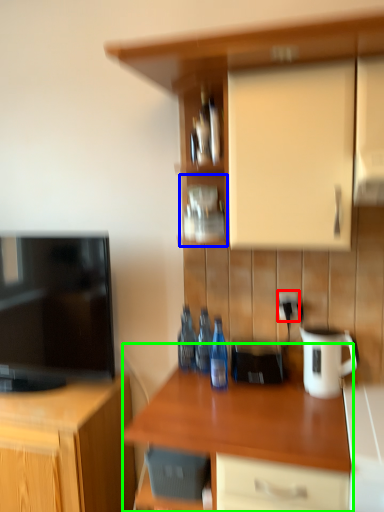
Question: Which is farther away from electric outlet (highlighted by a red box)? shelf (highlighted by a blue box) or countertop (highlighted by a green box)?

Choices:
 (A) shelf
 (B) countertop

Answer: (B)